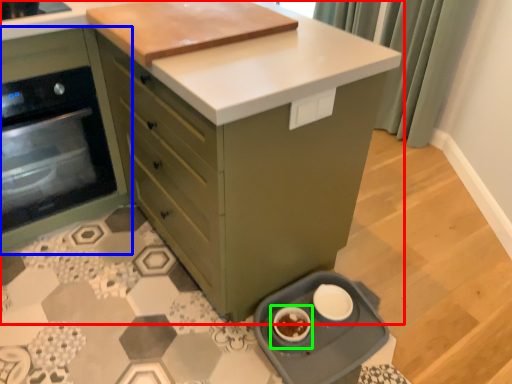
Question: Which object is the farthest from cabinetry (highlighted by a red box)? Choose among these: cabinetry (highlighted by a blue box) or appliance (highlighted by a green box).

Choices:
 (A) cabinetry
 (B) appliance

Answer: (B)